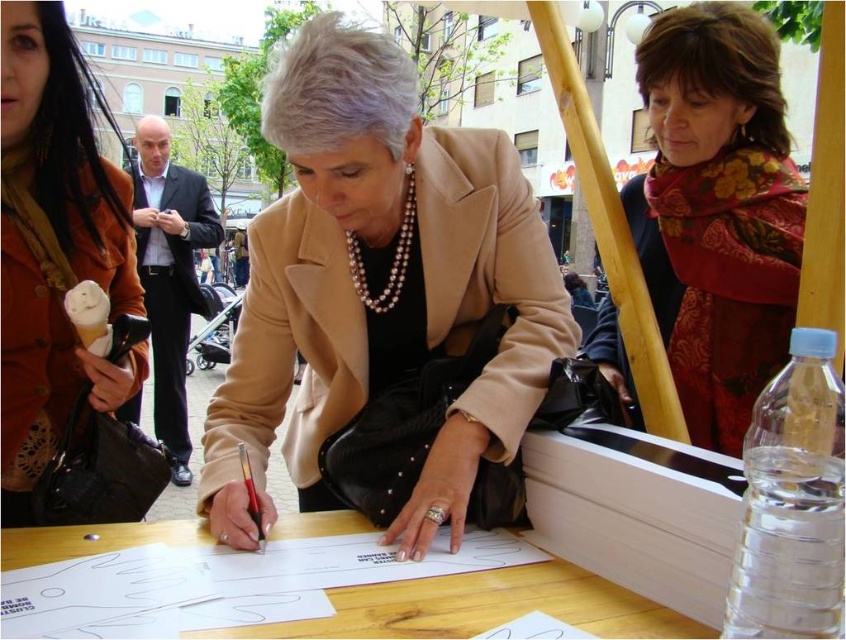
Question: Which point is closer to the camera?

Choices:
 (A) white creamy ice cream cone at lower left
 (B) wooden table at center
 (C) clear plastic bottle at lower right

Answer: (C)

Question: Does beige leather jacket at center appear over white creamy ice cream cone at lower left?

Choices:
 (A) no
 (B) yes

Answer: (B)

Question: Does beige leather jacket at center have a smaller size compared to floral scarf at upper right?

Choices:
 (A) yes
 (B) no

Answer: (B)

Question: Can you confirm if beige leather jacket at center is positioned to the left of clear plastic bottle at lower right?

Choices:
 (A) no
 (B) yes

Answer: (B)

Question: Which point is farther to the camera?

Choices:
 (A) (75, 365)
 (B) (267, 508)
 (C) (240, 442)
 (D) (690, 307)

Answer: (D)

Question: Which of these objects is positioned farthest from the beige leather jacket at center?

Choices:
 (A) metallic red pen at center
 (B) brown leather purse at left
 (C) clear plastic bottle at lower right
 (D) white creamy ice cream cone at lower left

Answer: (B)